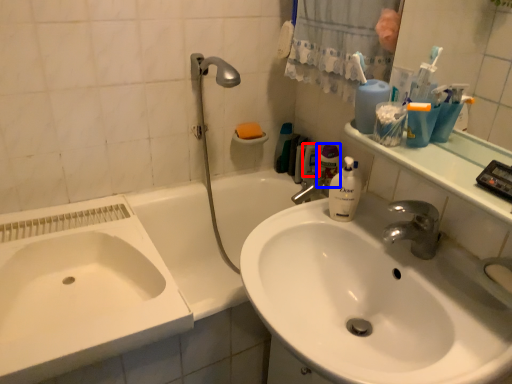
Question: Among these objects, which one is nearest to the camera, mouthwash (highlighted by a red box) or cleaning product (highlighted by a blue box)?

Choices:
 (A) mouthwash
 (B) cleaning product

Answer: (B)